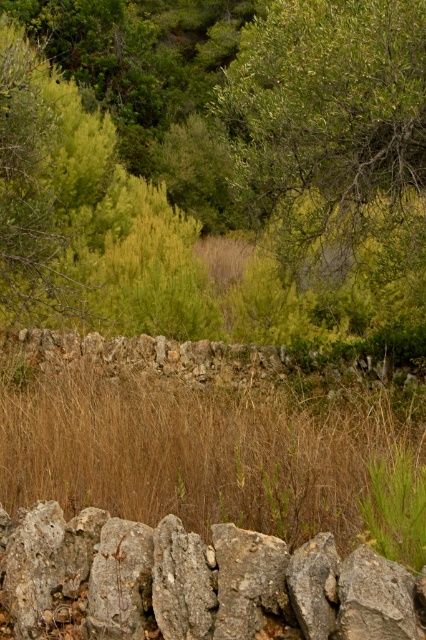
You are a gardener planning to plant new flowers in the area. Considering the gray rough stone at center and the green grass at center, which object would you need to move or avoid to create space for the flowers?

The gray rough stone at center has a larger size compared to green grass at center, so you would need to move the gray rough stone at center to create enough space for planting flowers.